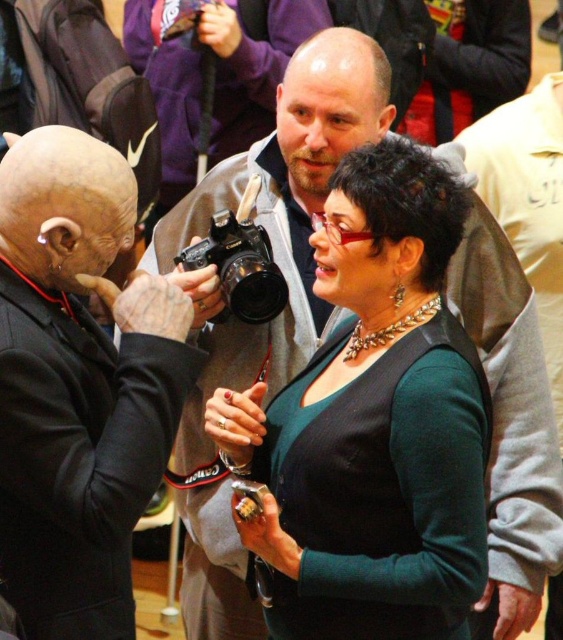
Which of these two, black matte suit at left or black plastic camera at center, stands taller?

Standing taller between the two is black matte suit at left.

In order to click on black matte suit at left in this screenshot , I will do `click(78, 387)`.

Is point (82, 616) positioned before point (227, 212)?

Yes, it is.

Where is `black matte suit at left`? This screenshot has height=640, width=563. black matte suit at left is located at coordinates click(x=78, y=387).

I want to click on green matte dress at center, so click(373, 422).

Locate an element on the screen. green matte dress at center is located at coordinates [373, 422].

Does green matte dress at center appear over black matte suit at left?

No, green matte dress at center is not above black matte suit at left.

Does point (417, 588) lie in front of point (39, 474)?

No.

In order to click on green matte dress at center in this screenshot , I will do pos(373,422).